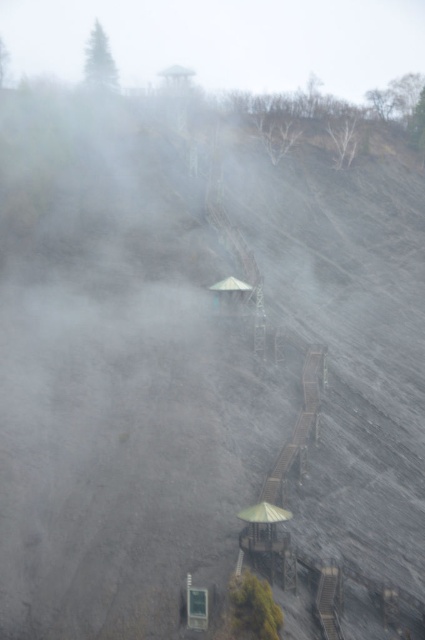
Does foggy gray cloud at upper center have a lesser width compared to metallic gray hut at center?

In fact, foggy gray cloud at upper center might be wider than metallic gray hut at center.

Is point (155, 16) closer to viewer compared to point (248, 301)?

That is False.

Where is `foggy gray cloud at upper center`? foggy gray cloud at upper center is located at coordinates (223, 40).